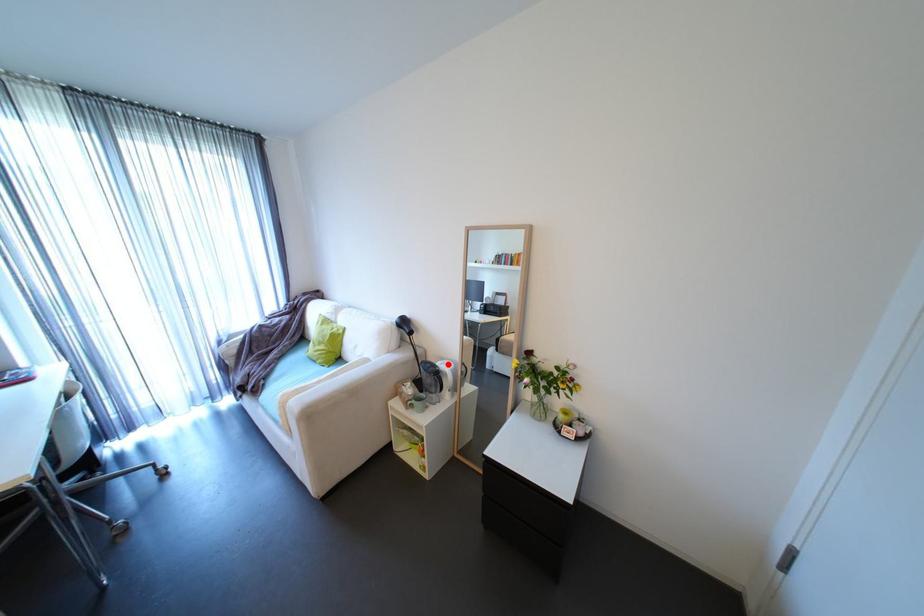
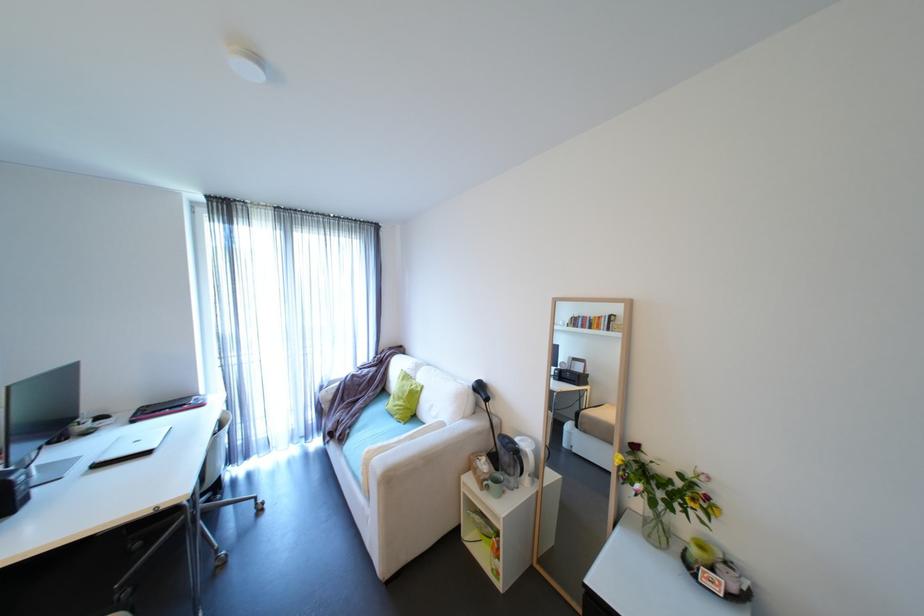
Find the pixel in the second image that matches the highlighted location in the first image.

(527, 440)